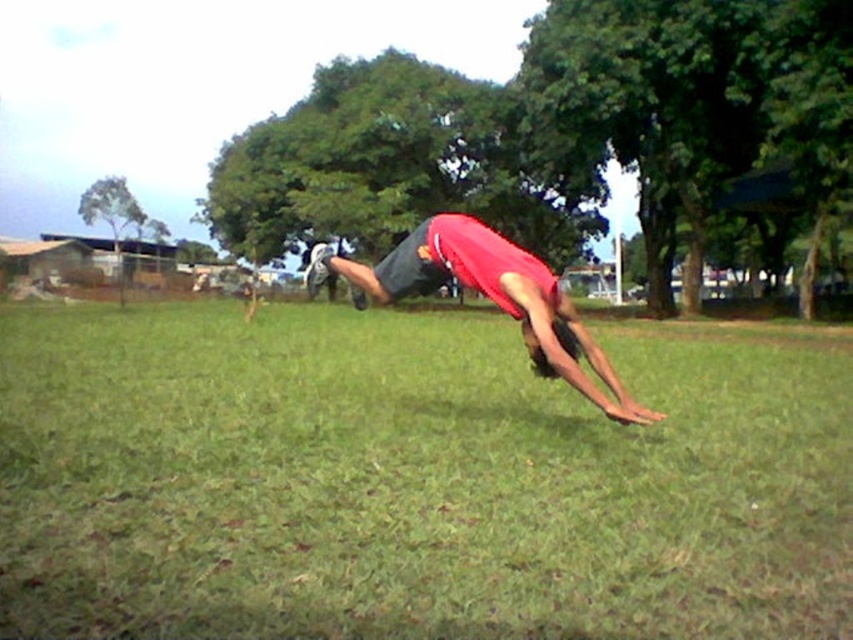
Between green grass at center and red matte shirt at center, which one is positioned higher?

red matte shirt at center is above.

Who is positioned more to the right, green grass at center or red matte shirt at center?

red matte shirt at center

Is point (96, 305) positioned behind point (537, 284)?

Yes, it is.

Identify the location of green grass at center. tap(410, 481).